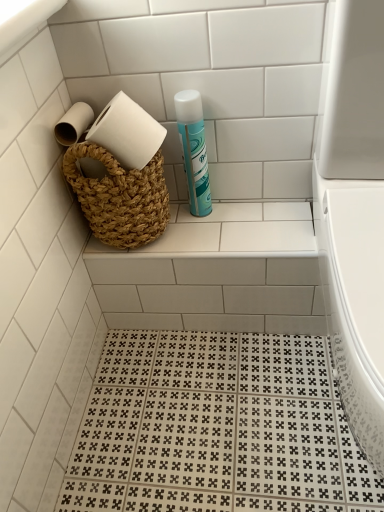
Question: Considering the relative sizes of white glossy toilet at right and natural woven basket at upper center in the image provided, is white glossy toilet at right wider than natural woven basket at upper center?

Choices:
 (A) no
 (B) yes

Answer: (B)

Question: From a real-world perspective, is white glossy toilet at right on natural woven basket at upper center?

Choices:
 (A) yes
 (B) no

Answer: (A)

Question: Is white glossy toilet at right thinner than natural woven basket at upper center?

Choices:
 (A) yes
 (B) no

Answer: (B)

Question: Can you confirm if white glossy toilet at right is shorter than natural woven basket at upper center?

Choices:
 (A) no
 (B) yes

Answer: (A)

Question: Is white glossy toilet at right facing away from natural woven basket at upper center?

Choices:
 (A) no
 (B) yes

Answer: (A)

Question: In the image, is natural woven basket at upper center on the left side or the right side of teal matte cleaning product at upper center?

Choices:
 (A) right
 (B) left

Answer: (B)

Question: Relative to teal matte cleaning product at upper center, is natural woven basket at upper center in front or behind?

Choices:
 (A) front
 (B) behind

Answer: (B)

Question: From a real-world perspective, is natural woven basket at upper center positioned above or below teal matte cleaning product at upper center?

Choices:
 (A) below
 (B) above

Answer: (A)

Question: Considering the positions of natural woven basket at upper center and teal matte cleaning product at upper center in the image, is natural woven basket at upper center wider or thinner than teal matte cleaning product at upper center?

Choices:
 (A) thin
 (B) wide

Answer: (B)

Question: From the image's perspective, relative to natural woven basket at upper center, is teal matte cleaning product at upper center above or below?

Choices:
 (A) below
 (B) above

Answer: (B)

Question: In terms of size, does teal matte cleaning product at upper center appear bigger or smaller than natural woven basket at upper center?

Choices:
 (A) small
 (B) big

Answer: (A)

Question: From their relative heights in the image, would you say teal matte cleaning product at upper center is taller or shorter than natural woven basket at upper center?

Choices:
 (A) short
 (B) tall

Answer: (B)

Question: Is teal matte cleaning product at upper center inside the boundaries of natural woven basket at upper center, or outside?

Choices:
 (A) outside
 (B) inside

Answer: (A)

Question: In terms of size, does white glossy toilet at right appear bigger or smaller than natural woven basket at upper center?

Choices:
 (A) big
 (B) small

Answer: (A)

Question: Would you say white glossy toilet at right is to the left or to the right of natural woven basket at upper center in the picture?

Choices:
 (A) right
 (B) left

Answer: (A)